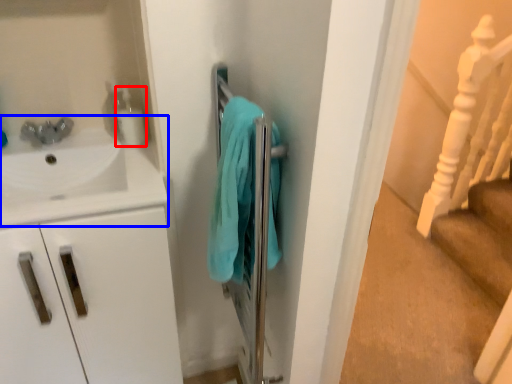
Question: Which object appears farthest to the camera in this image, soap dispenser (highlighted by a red box) or sink (highlighted by a blue box)?

Choices:
 (A) soap dispenser
 (B) sink

Answer: (A)